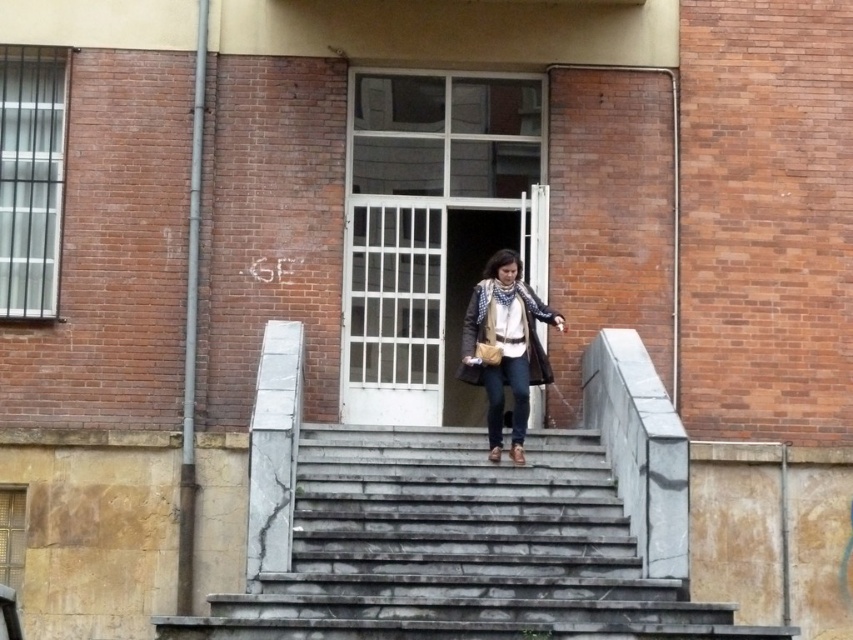
Can you confirm if gray marble stairs at center is positioned above brown leather jacket at center?

No, gray marble stairs at center is not above brown leather jacket at center.

Identify the location of gray marble stairs at center. pos(457,548).

The image size is (853, 640). Find the location of `gray marble stairs at center`. gray marble stairs at center is located at coordinates (457, 548).